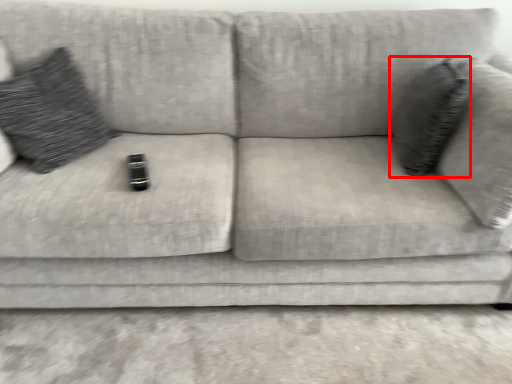
Question: Observing the image, what is the correct spatial positioning of throw pillow (annotated by the red box) in reference to throw pillow?

Choices:
 (A) right
 (B) left

Answer: (A)